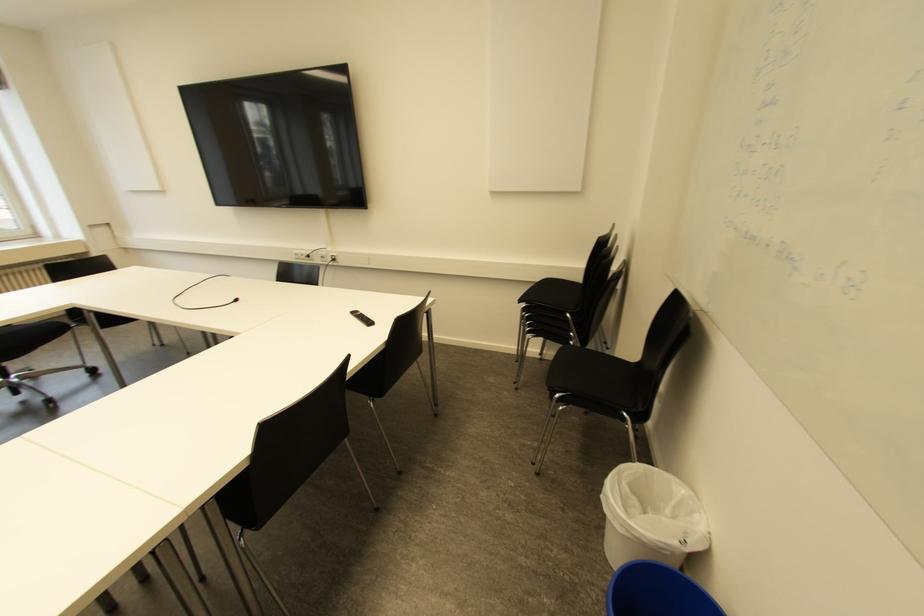
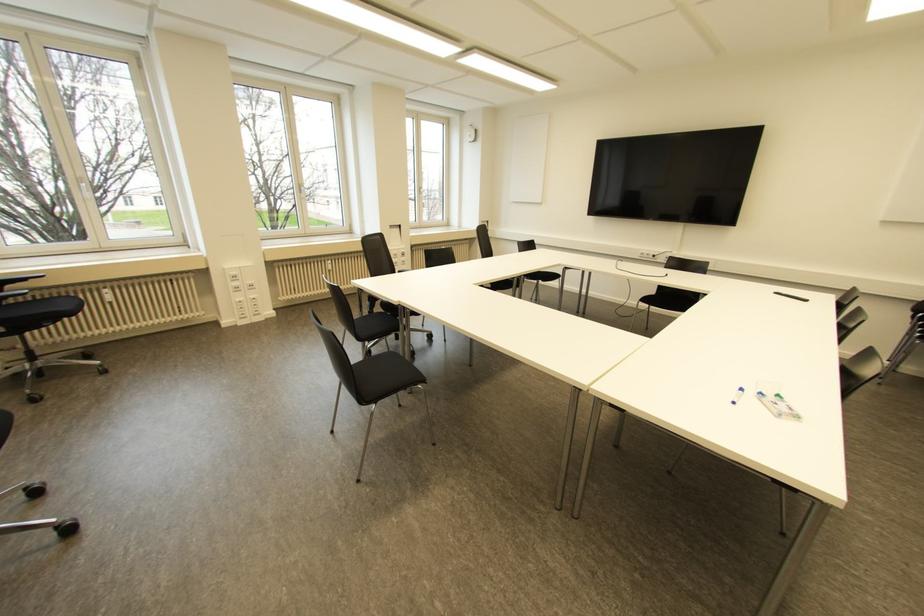
Which direction would the cameraman need to move to produce the second image?

The cameraman moved toward left, backward.